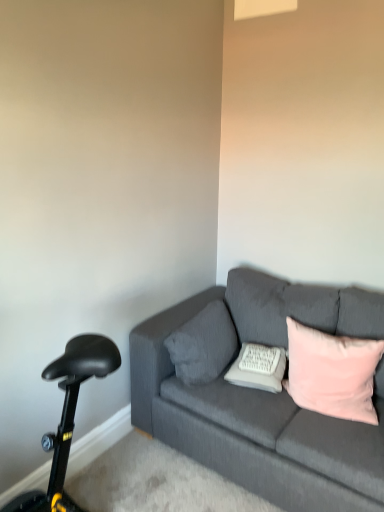
Question: Can you confirm if dark gray fabric couch at center is positioned to the left of white textured pillow at center, the second pillow when ordered from right to left?

Choices:
 (A) yes
 (B) no

Answer: (B)

Question: Is dark gray fabric couch at center bigger than white textured pillow at center, the second pillow when ordered from right to left?

Choices:
 (A) yes
 (B) no

Answer: (A)

Question: From the image's perspective, is dark gray fabric couch at center located above white textured pillow at center, the second pillow when ordered from right to left?

Choices:
 (A) yes
 (B) no

Answer: (B)

Question: Considering the relative sizes of dark gray fabric couch at center and white textured pillow at center, the second pillow when ordered from right to left, in the image provided, is dark gray fabric couch at center taller than white textured pillow at center, the second pillow when ordered from right to left,?

Choices:
 (A) yes
 (B) no

Answer: (A)

Question: Is white textured pillow at center, the second pillow positioned from the left, a part of dark gray fabric couch at center?

Choices:
 (A) yes
 (B) no

Answer: (A)

Question: Can you confirm if dark gray fabric couch at center is smaller than white textured pillow at center, the second pillow positioned from the left?

Choices:
 (A) no
 (B) yes

Answer: (A)

Question: Is textured gray pillow at center, the first pillow when ordered from left to right, turned away from white textured pillow at center, the second pillow positioned from the left?

Choices:
 (A) yes
 (B) no

Answer: (B)

Question: Does textured gray pillow at center, which is counted as the 3th pillow, starting from the right, have a lesser height compared to white textured pillow at center, the second pillow positioned from the left?

Choices:
 (A) no
 (B) yes

Answer: (A)

Question: Does textured gray pillow at center, which is counted as the 3th pillow, starting from the right, come behind white textured pillow at center, the second pillow positioned from the left?

Choices:
 (A) no
 (B) yes

Answer: (A)

Question: Does textured gray pillow at center, which is counted as the 3th pillow, starting from the right, contain white textured pillow at center, the second pillow positioned from the left?

Choices:
 (A) no
 (B) yes

Answer: (A)

Question: Does textured gray pillow at center, which is counted as the 3th pillow, starting from the right, touch white textured pillow at center, the second pillow when ordered from right to left?

Choices:
 (A) no
 (B) yes

Answer: (A)

Question: From a real-world perspective, is textured gray pillow at center, which is counted as the 3th pillow, starting from the right, positioned over white textured pillow at center, the second pillow when ordered from right to left, based on gravity?

Choices:
 (A) no
 (B) yes

Answer: (B)

Question: Does textured gray pillow at center, which is counted as the 3th pillow, starting from the right, appear on the right side of pink velvet pillow at right, the third pillow in the left-to-right sequence?

Choices:
 (A) yes
 (B) no

Answer: (B)